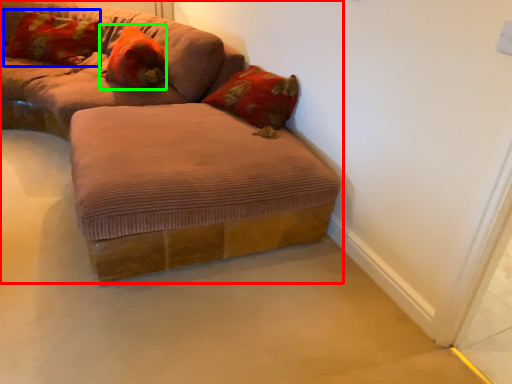
Question: Considering the real-world distances, which object is closest to studio couch (highlighted by a red box)? pillow (highlighted by a blue box) or pillow (highlighted by a green box).

Choices:
 (A) pillow
 (B) pillow

Answer: (B)